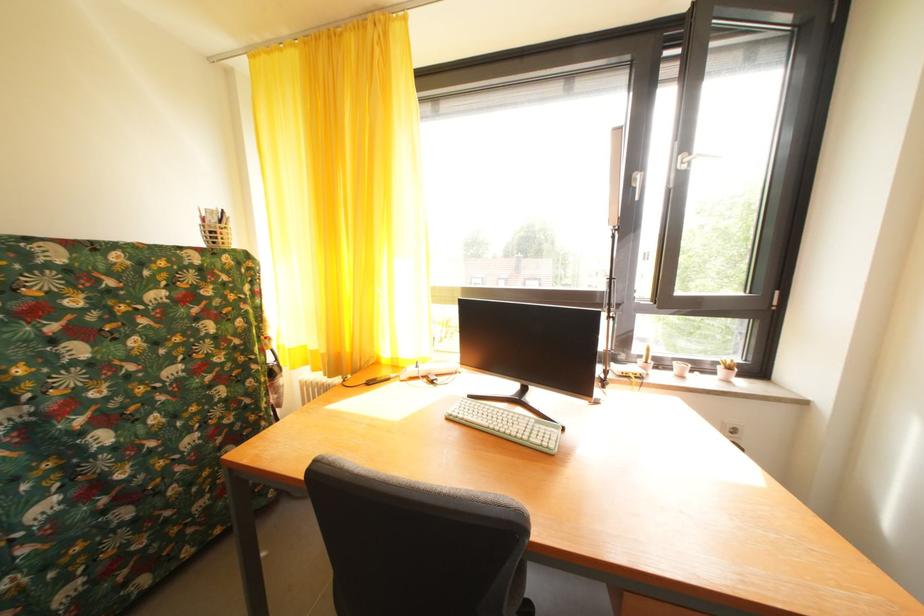
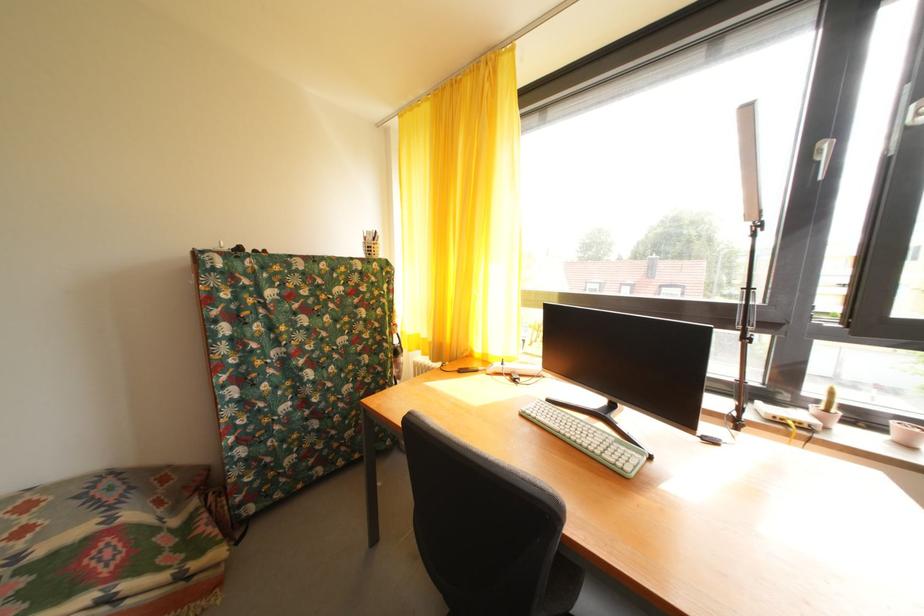
The point at (621, 370) is marked in the first image. Where is the corresponding point in the second image?

(768, 408)